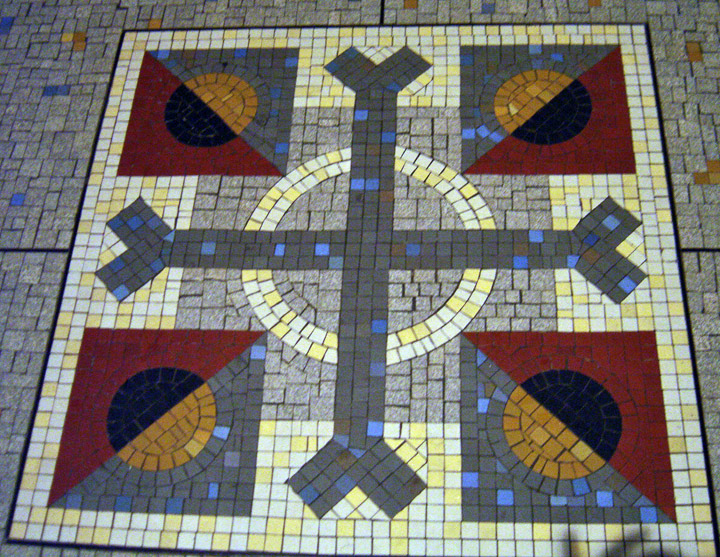
Locate an element on the screen. light yellow square tile is located at coordinates (279, 527).